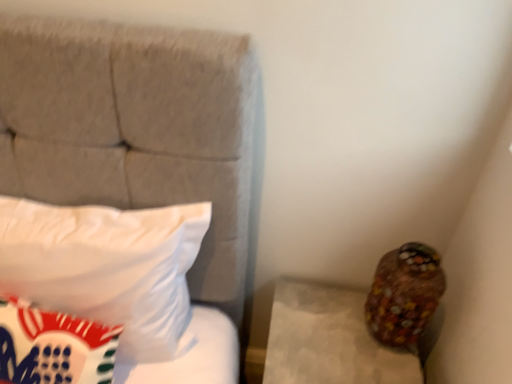
Question: Should I look upward or downward to see multicolored glass vase at lower right?

Choices:
 (A) up
 (B) down

Answer: (B)

Question: Can you confirm if multicolored glass vase at lower right is taller than white soft pillow at left?

Choices:
 (A) no
 (B) yes

Answer: (A)

Question: Does multicolored glass vase at lower right appear on the left side of white soft pillow at left?

Choices:
 (A) no
 (B) yes

Answer: (A)

Question: From a real-world perspective, is multicolored glass vase at lower right under white soft pillow at left?

Choices:
 (A) no
 (B) yes

Answer: (B)

Question: Is multicolored glass vase at lower right turned away from white soft pillow at left?

Choices:
 (A) yes
 (B) no

Answer: (B)

Question: Considering the relative positions of multicolored glass vase at lower right and white soft pillow at left in the image provided, is multicolored glass vase at lower right to the right of white soft pillow at left from the viewer's perspective?

Choices:
 (A) no
 (B) yes

Answer: (B)

Question: From a real-world perspective, is multicolored glass vase at lower right on top of white soft pillow at left?

Choices:
 (A) no
 (B) yes

Answer: (A)

Question: Is white soft pillow at left far from multicolored glass vase at lower right?

Choices:
 (A) no
 (B) yes

Answer: (A)

Question: Does white soft pillow at left have a greater height compared to multicolored glass vase at lower right?

Choices:
 (A) yes
 (B) no

Answer: (A)

Question: Is white soft pillow at left wider than multicolored glass vase at lower right?

Choices:
 (A) yes
 (B) no

Answer: (A)

Question: From the image's perspective, does white soft pillow at left appear higher than multicolored glass vase at lower right?

Choices:
 (A) no
 (B) yes

Answer: (B)

Question: Is white soft pillow at left at the left side of multicolored glass vase at lower right?

Choices:
 (A) no
 (B) yes

Answer: (B)

Question: Is white soft pillow at left completely or partially outside of multicolored glass vase at lower right?

Choices:
 (A) no
 (B) yes

Answer: (B)

Question: From a real-world perspective, is multicolored glass vase at lower right positioned above or below white soft pillow at left?

Choices:
 (A) above
 (B) below

Answer: (B)